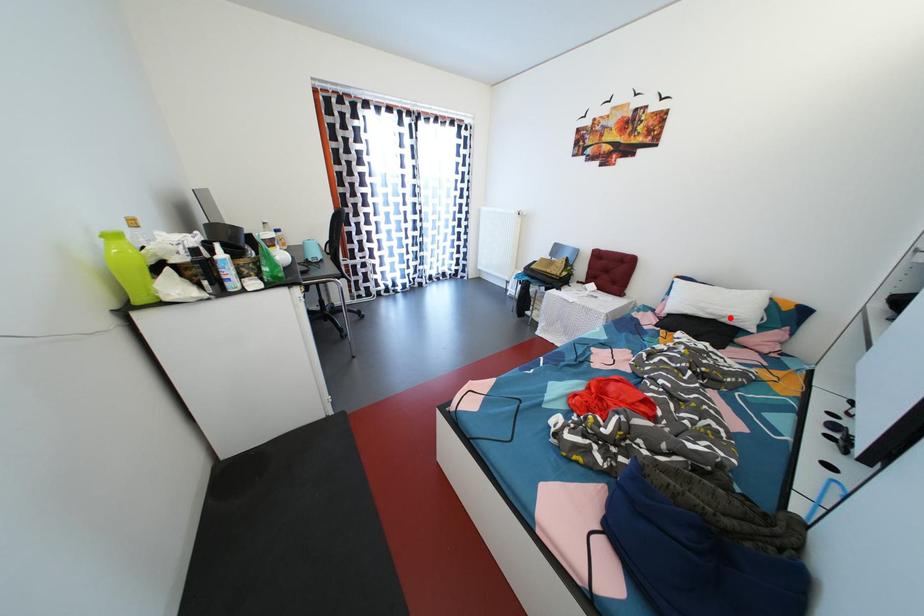
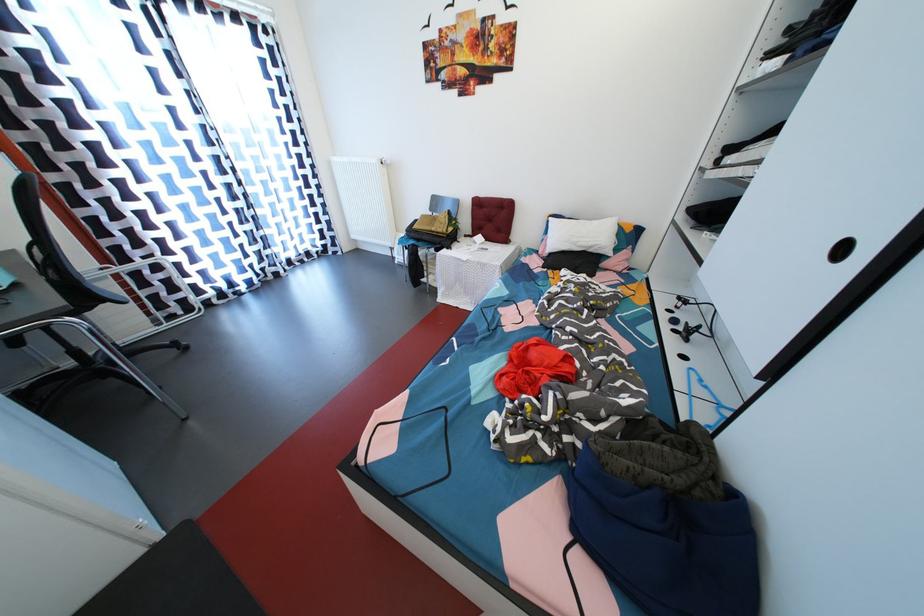
Question: I am providing you with two images of the same scene from different viewpoints. Image1 has a red point marked. In image2, the corresponding 3D location appears at what relative position? Reply with the corresponding letter.

Choices:
 (A) Closer
 (B) Farther

Answer: (A)